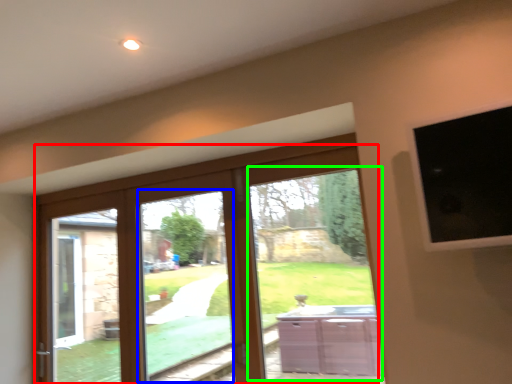
Question: Based on their relative distances, which object is farther from door (highlighted by a red box)? Choose from window (highlighted by a blue box) and bay window (highlighted by a green box).

Choices:
 (A) window
 (B) bay window

Answer: (A)